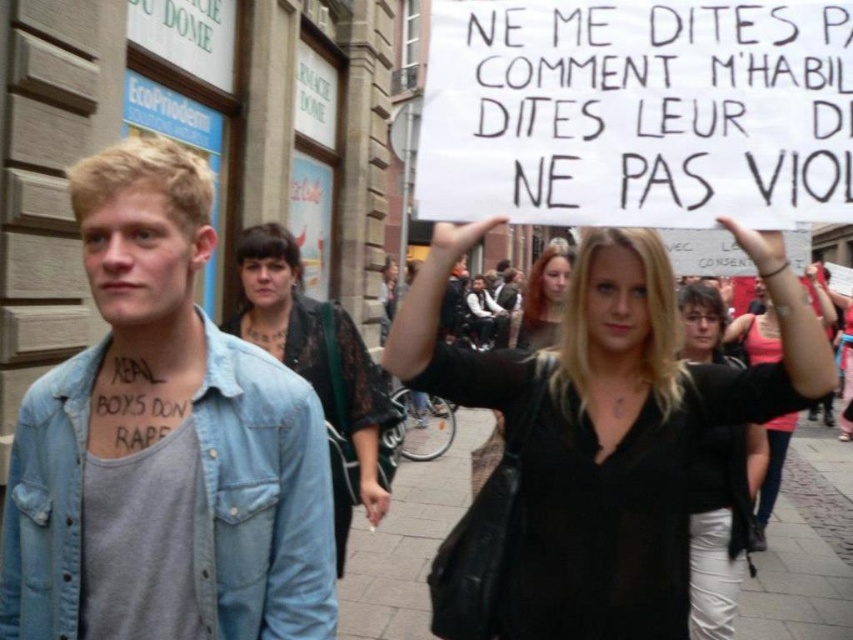
You are a photographer taking a picture of the protest scene. The black leather jacket at center is positioned at coordinates 0.689 on the x and 0.747 on the y. If you want to frame the jacket in the center of your shot, should you adjust your camera to the left or right? How about up or down?

The black leather jacket at center is already at coordinates 0.689 on the x and 0.747 on the y. Since the center of the image is typically at coordinates (426, 320), you would need to adjust your camera slightly to the right and down to center the jacket. Moving right because the x is higher than 0.5 and down because the y is higher than 0.5.